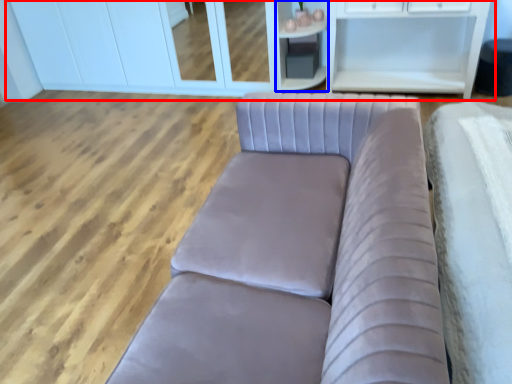
Question: Which object appears farthest to the camera in this image, dresser (highlighted by a red box) or cabinetry (highlighted by a blue box)?

Choices:
 (A) dresser
 (B) cabinetry

Answer: (A)